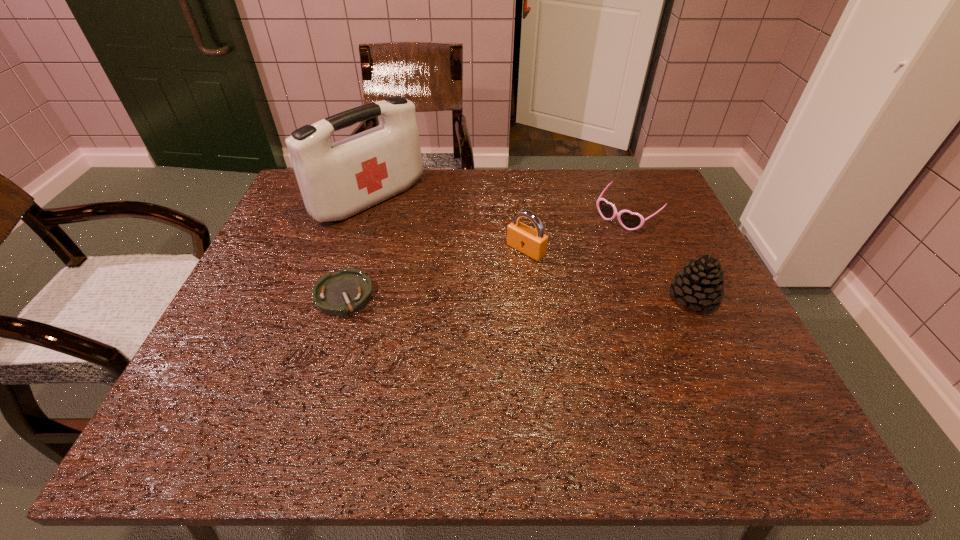
Where is `empty space between the tallest object and the fourth tallest object`? Image resolution: width=960 pixels, height=540 pixels. empty space between the tallest object and the fourth tallest object is located at coordinates (498, 208).

You are a GUI agent. You are given a task and a screenshot of the screen. Output one action in this format:
    pyautogui.click(x=<x>, y=<y>)
    Task: Click on the free point between the padlock and the tallest object
    
    Given the screenshot: What is the action you would take?
    pyautogui.click(x=447, y=225)

What are the coordinates of `vacant area that lies between the pinecone and the shortest object` in the screenshot? It's located at (518, 296).

Image resolution: width=960 pixels, height=540 pixels. Identify the location of the second closest object relative to the tallest object. (533, 243).

Identify which object is located as the nearest to the shortest object. Please provide its 2D coordinates. Your answer should be formatted as a tuple, i.e. [(x, y)], where the tuple contains the x and y coordinates of a point satisfying the conditions above.

[(337, 180)]

What are the coordinates of `free spot that satisfies the following two spatial constraints: 1. on the front side of the pinecone; 2. at the narrow end of the sunglasses` in the screenshot? It's located at (660, 298).

Locate an element on the screen. The height and width of the screenshot is (540, 960). vacant region that satisfies the following two spatial constraints: 1. on the back side of the padlock; 2. on the left side of the sunglasses is located at coordinates (522, 215).

Locate an element on the screen. Image resolution: width=960 pixels, height=540 pixels. vacant region that satisfies the following two spatial constraints: 1. on the front side of the first-aid kit; 2. on the right side of the padlock is located at coordinates (353, 250).

I want to click on free space that satisfies the following two spatial constraints: 1. on the front side of the pinecone; 2. at the narrow end of the fourth tallest object, so click(660, 298).